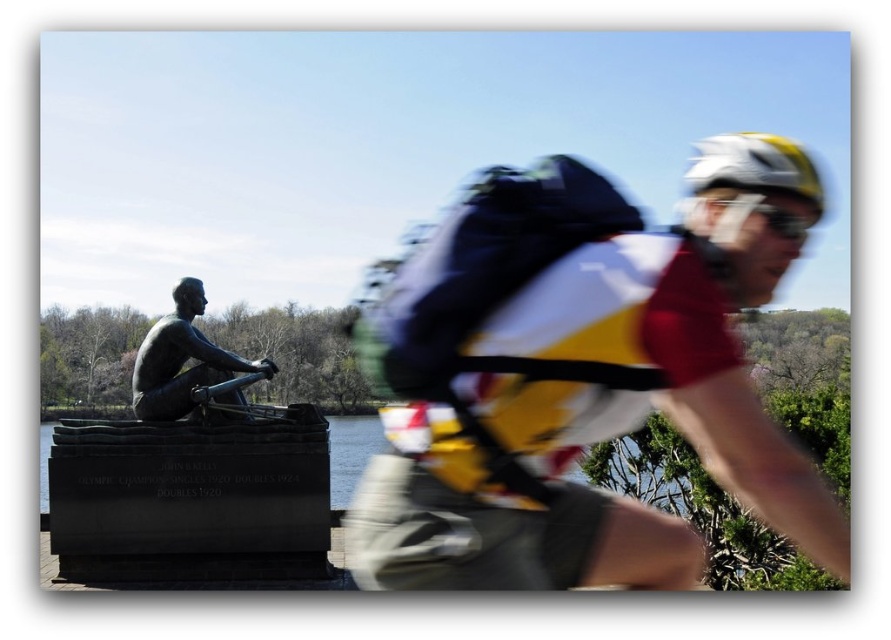
Question: Which of the following is the farthest from the observer?

Choices:
 (A) white matte bicycle helmet at upper right
 (B) bronze statue at left
 (C) yellow and white jersey at center

Answer: (B)

Question: Which point is farther from the camera taking this photo?

Choices:
 (A) (709, 140)
 (B) (729, 264)
 (C) (467, 364)

Answer: (A)

Question: Is clear water at statue left above bronze statue at left?

Choices:
 (A) yes
 (B) no

Answer: (B)

Question: Is yellow and white jersey at center to the right of clear water at statue left from the viewer's perspective?

Choices:
 (A) no
 (B) yes

Answer: (B)

Question: Does clear water at statue left appear over bronze statue at left?

Choices:
 (A) yes
 (B) no

Answer: (B)

Question: Which object appears farthest from the camera in this image?

Choices:
 (A) white matte helmet at upper right
 (B) clear water at statue left
 (C) white matte bicycle helmet at upper right
 (D) bronze statue at left

Answer: (D)